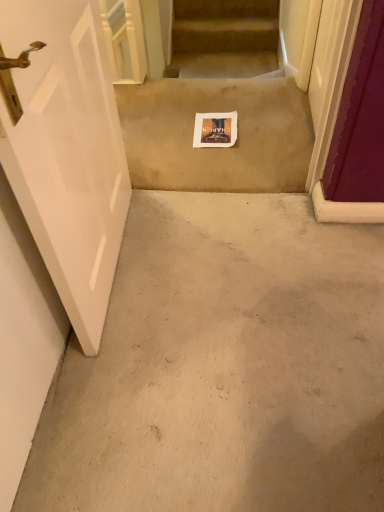
Locate an element on the screen. The image size is (384, 512). free space above beige carpet at center (from a real-world perspective) is located at coordinates (206, 112).